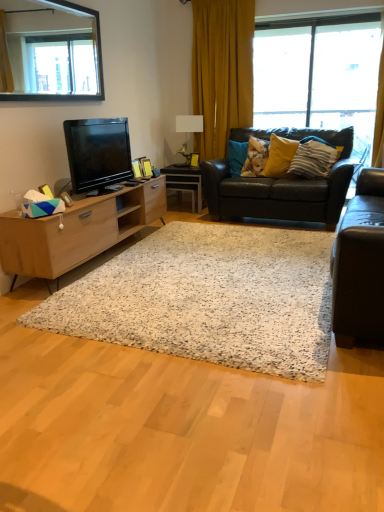
Locate an element on the screen. This screenshot has height=512, width=384. blank space situated above white shag rug at center (from a real-world perspective) is located at coordinates (225, 246).